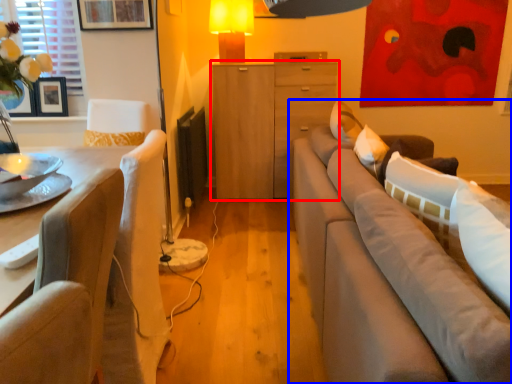
Question: Which of the following is the closest to the observer, cabinetry (highlighted by a red box) or studio couch (highlighted by a blue box)?

Choices:
 (A) cabinetry
 (B) studio couch

Answer: (B)